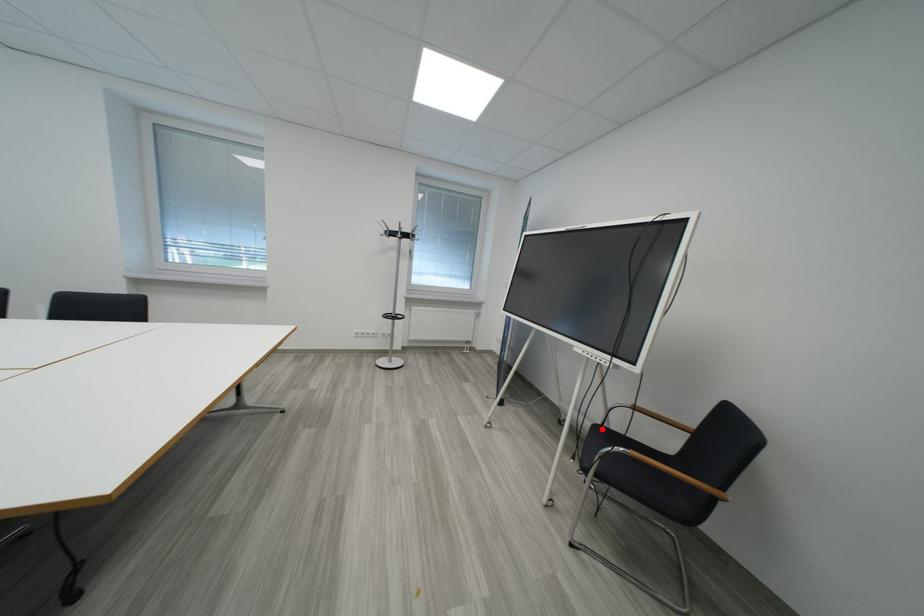
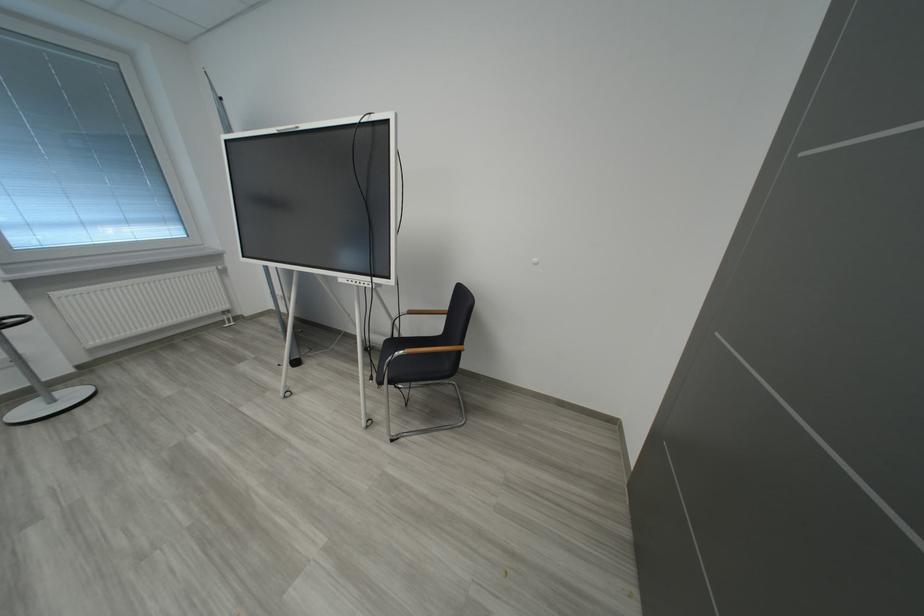
Question: I am providing you with two images of the same scene from different viewpoints. A red point is marked on the first image. At the location where the point appears in image 1, is it still visible in image 2?

Choices:
 (A) Yes
 (B) No

Answer: (A)